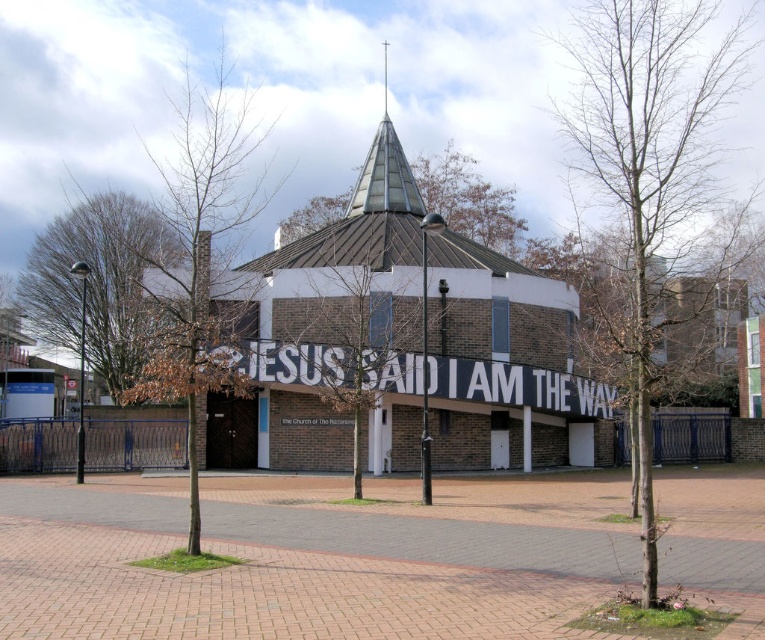
You are a GUI agent. You are given a task and a screenshot of the screen. Output one action in this format:
    pyautogui.click(x=<x>, y=<y>)
    Task: Click on the brick textured church at center
    The width and height of the screenshot is (765, 640).
    Given the screenshot: What is the action you would take?
    pyautogui.click(x=399, y=344)